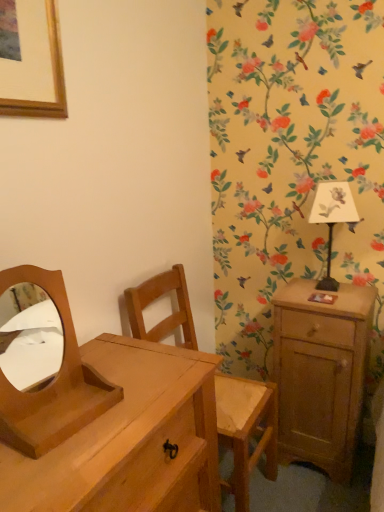
Where is `empty space that is to the right of wooden/matte mirror at left`? This screenshot has width=384, height=512. empty space that is to the right of wooden/matte mirror at left is located at coordinates (132, 410).